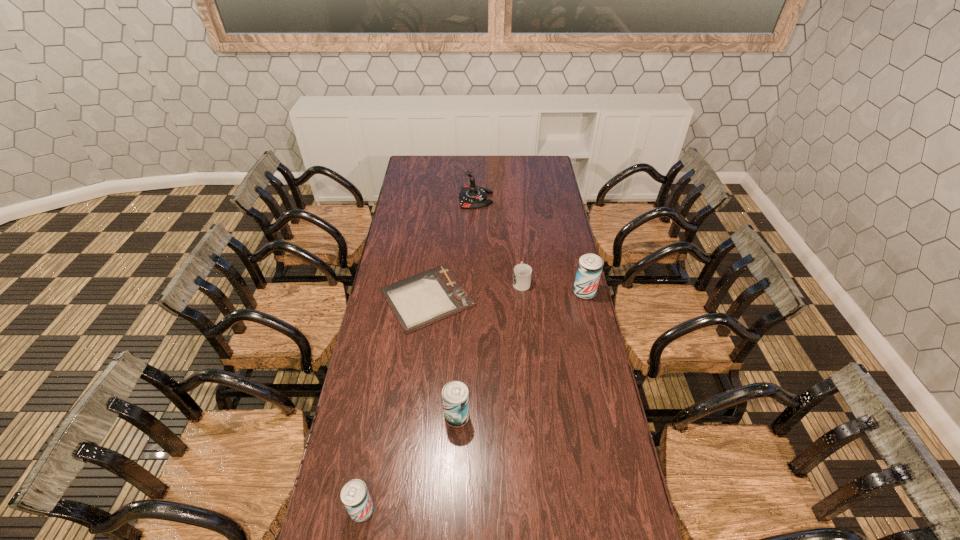
Where is `clipboard at the left edge`? clipboard at the left edge is located at coordinates tap(418, 301).

Find the location of a particular element. The height and width of the screenshot is (540, 960). object that is positioned at the right edge is located at coordinates (589, 269).

Locate an element on the screen. object that is positioned at the near left corner is located at coordinates (355, 496).

Locate an element on the screen. This screenshot has height=540, width=960. free space at the far edge is located at coordinates (456, 161).

Find the location of a particular element. free region at the near edge of the desktop is located at coordinates (387, 507).

Locate an element on the screen. The image size is (960, 540). blank space at the left edge is located at coordinates (412, 191).

In the image, there is a desktop. At what (x,y) coordinates should I click in order to perform the action: click on free space at the right edge. Please return your answer as a coordinate pair (x, y). Looking at the image, I should click on (548, 211).

In the image, there is a desktop. Identify the location of vacant space at the near left corner. (351, 527).

You are a GUI agent. You are given a task and a screenshot of the screen. Output one action in this format:
    pyautogui.click(x=<x>, y=<y>)
    Task: Click on the free area in between the cup and the second farthest beer can
    
    Given the screenshot: What is the action you would take?
    click(490, 349)

Identify the location of vacant space in between the clipboard and the second nearest beer can. Image resolution: width=960 pixels, height=540 pixels. click(x=443, y=357).